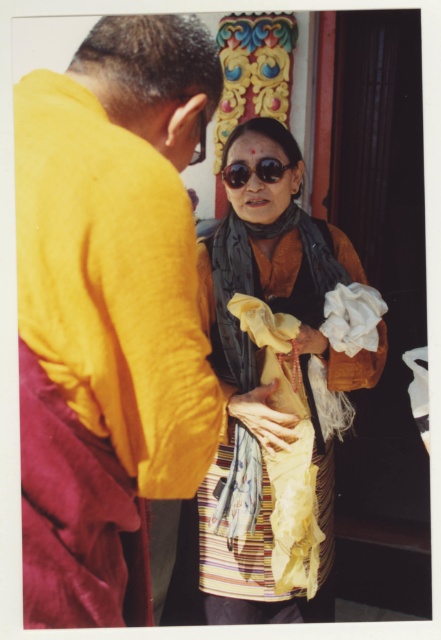
You are a tailor measuring two yellow items in the image. The yellow cotton robe at center and the textured yellow fabric at center. If the minimum distance required for your measuring tape is 3 feet, can you measure both items without moving the tape?

The yellow cotton robe at center is 3.68 feet from the textured yellow fabric at center. Since the distance between them is more than 3 feet, the measuring tape can reach both items without moving it.

You are a fashion designer observing the image. You need to decide which item, the textured yellow fabric at center or the matte black sunglasses at center, would require more fabric material to produce. Based on the size comparison in the image, which one would you choose?

The textured yellow fabric at center has a larger size compared to matte black sunglasses at center, so it would require more fabric material to produce.

You are standing in the scene and want to hand a gift to the person wearing the yellow cotton robe at center. Which direction should you move to reach them?

The yellow cotton robe at center is located at point (x=122, y=243), so you should move towards the center of the scene to reach the person wearing the yellow cotton robe at center.